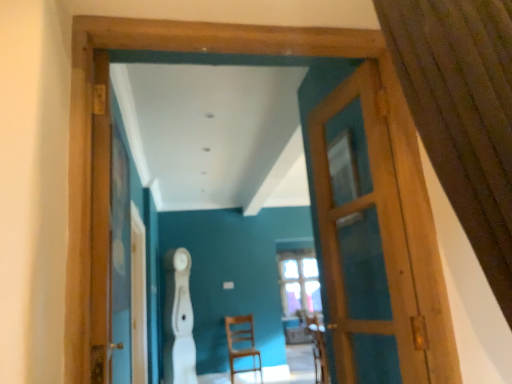
Question: In the image, is wooden door at center positioned in front of or behind wooden chair at center?

Choices:
 (A) front
 (B) behind

Answer: (A)

Question: In terms of size, does wooden door at center appear bigger or smaller than wooden chair at center?

Choices:
 (A) small
 (B) big

Answer: (A)

Question: Estimate the real-world distances between objects in this image. Which object is farther from the wooden chair at center?

Choices:
 (A) wooden screen door at left
 (B) wooden armchair at center
 (C) brown textured curtain at upper right
 (D) wooden door at center

Answer: (C)

Question: Considering the real-world distances, which object is closest to the brown textured curtain at upper right?

Choices:
 (A) wooden chair at center
 (B) wooden screen door at left
 (C) wooden armchair at center
 (D) wooden door at center

Answer: (D)